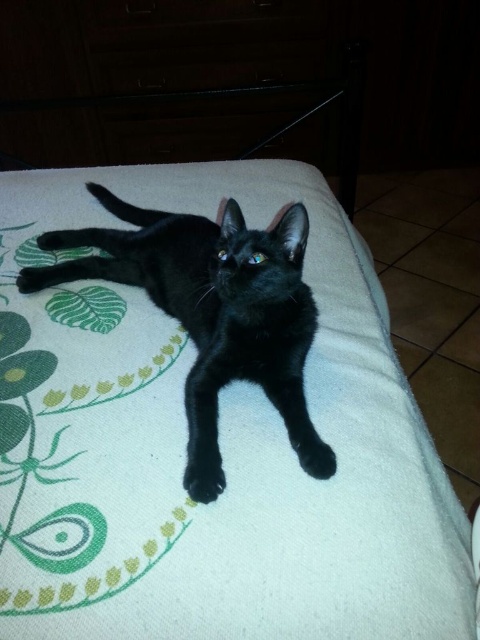
Question: Which point appears farthest from the camera in this image?

Choices:
 (A) (204, 500)
 (B) (181, 417)

Answer: (B)

Question: Is white soft blanket at center closer to camera compared to black matte cat at center?

Choices:
 (A) no
 (B) yes

Answer: (B)

Question: Does white soft blanket at center appear over black matte cat at center?

Choices:
 (A) yes
 (B) no

Answer: (B)

Question: Does white soft blanket at center lie in front of black matte cat at center?

Choices:
 (A) yes
 (B) no

Answer: (A)

Question: Which point is farther to the camera?

Choices:
 (A) white soft blanket at center
 (B) black matte cat at center

Answer: (B)